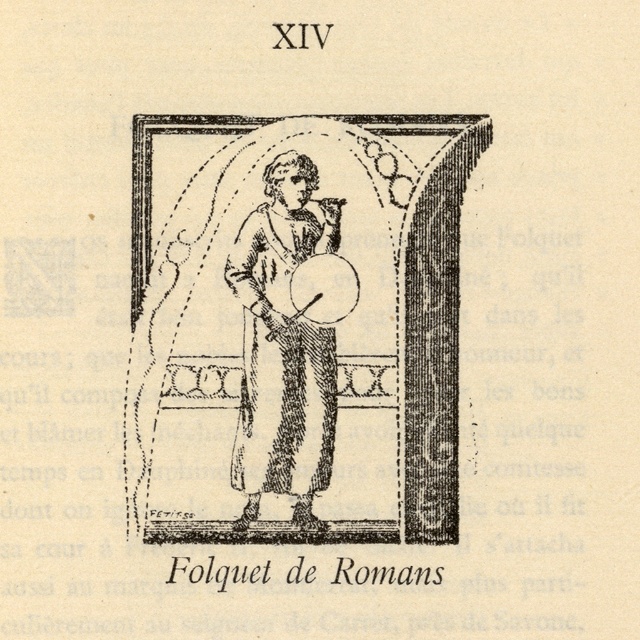
Question: Is black ink drawing of man at center behind black ink drawing of person at center?

Choices:
 (A) no
 (B) yes

Answer: (B)

Question: Is black ink drawing of man at center to the left of black ink drawing of person at center from the viewer's perspective?

Choices:
 (A) no
 (B) yes

Answer: (A)

Question: Does black ink drawing of man at center come in front of black ink drawing of person at center?

Choices:
 (A) no
 (B) yes

Answer: (A)

Question: Which point appears farthest from the camera in this image?

Choices:
 (A) (349, 465)
 (B) (250, 451)

Answer: (A)